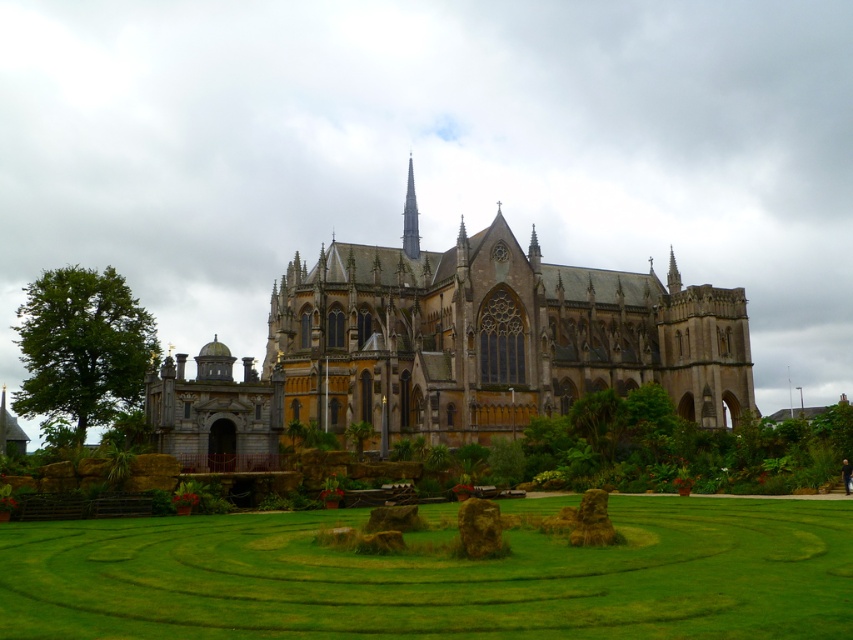
You are standing in the garden of the cathedral and want to walk towards the yellow stone church at center. Which direction should you move relative to the green grass maze at center?

Since the green grass maze at center is closer to you than the yellow stone church at center, you should move away from the green grass maze at center to reach the yellow stone church at center.

You are planning a guided tour for visitors and want to ensure they can easily navigate between the green grass maze at center and the yellow stone church at center. Based on their sizes, which one should you advise visitors to approach first for better visibility?

The green grass maze at center has a smaller size compared to the yellow stone church at center, so visitors should approach the yellow stone church at center first to ensure they can see it clearly before moving to the smaller maze.